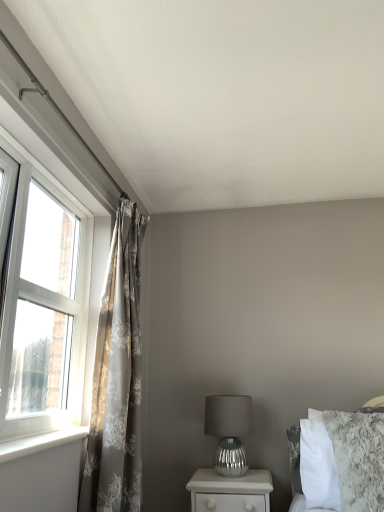
This screenshot has width=384, height=512. I want to click on vacant space underneath silver metallic table lamp at center (from a real-world perspective), so click(230, 475).